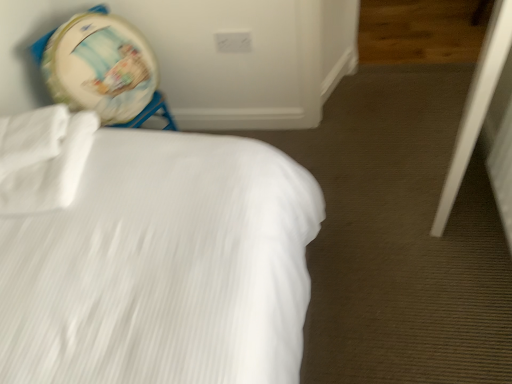
Locate an element on the screen. This screenshot has width=512, height=384. vacant space situated on the left part of white plastic screen door at lower right is located at coordinates (372, 188).